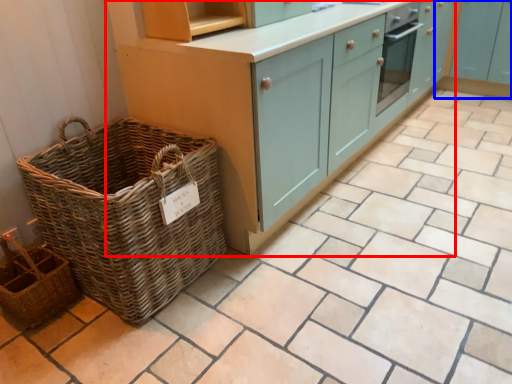
Question: Which object appears farthest to the camera in this image, cabinetry (highlighted by a red box) or cabinetry (highlighted by a blue box)?

Choices:
 (A) cabinetry
 (B) cabinetry

Answer: (B)